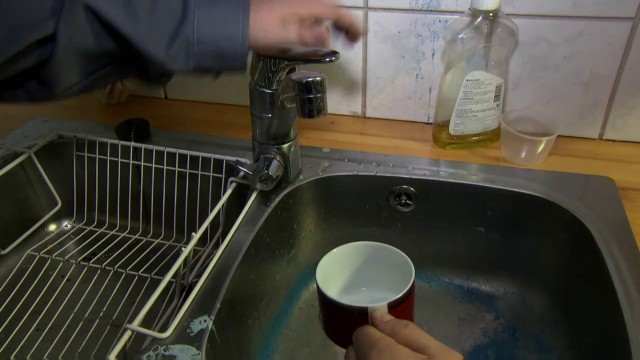
Find the location of a particular element. This screenshot has height=360, width=640. faucet is located at coordinates (278, 138).